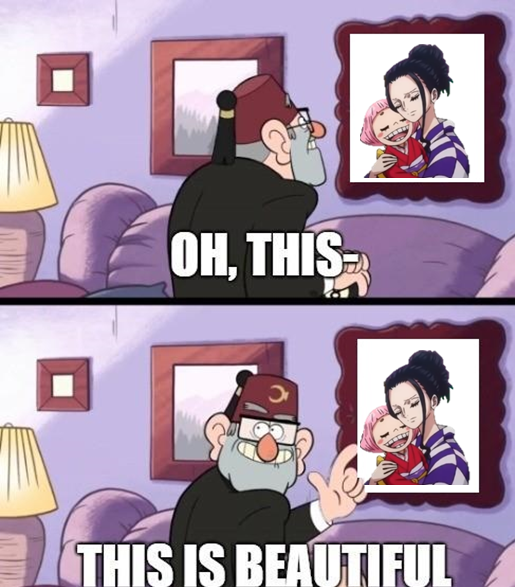
I want to click on blue background, wall, so click(x=308, y=59).